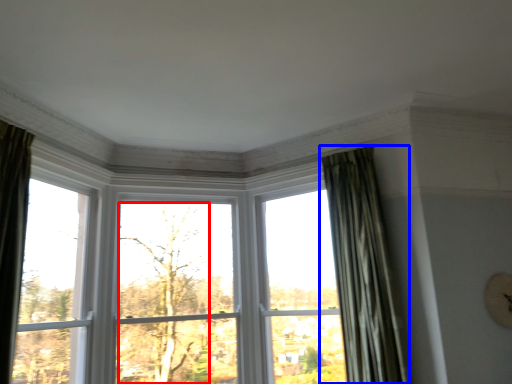
Question: Which of the following is the farthest to the observer, tree (highlighted by a red box) or curtain (highlighted by a blue box)?

Choices:
 (A) tree
 (B) curtain

Answer: (A)